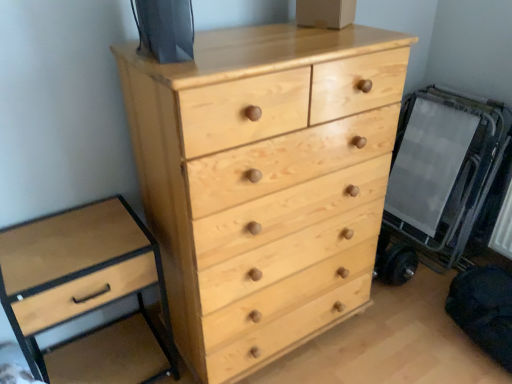
Question: In terms of width, does light wood/texture drawer at left, the 2th chest of drawers from the right, look wider or thinner when compared to natural wood chest of drawers at center, the second chest of drawers from the left?

Choices:
 (A) thin
 (B) wide

Answer: (A)

Question: Is light wood/texture drawer at left, which is the 1th chest of drawers from left to right, in front of or behind natural wood chest of drawers at center, the second chest of drawers from the left, in the image?

Choices:
 (A) front
 (B) behind

Answer: (B)

Question: From the image's perspective, relative to natural wood chest of drawers at center, which appears as the first chest of drawers when viewed from the right, is light wood/texture drawer at left, which is the 1th chest of drawers from left to right, above or below?

Choices:
 (A) below
 (B) above

Answer: (A)

Question: From a real-world perspective, is natural wood chest of drawers at center, which appears as the first chest of drawers when viewed from the right, above or below light wood/texture drawer at left, which is the 1th chest of drawers from left to right?

Choices:
 (A) above
 (B) below

Answer: (A)

Question: Which is correct: natural wood chest of drawers at center, the second chest of drawers from the left, is inside light wood/texture drawer at left, the 2th chest of drawers from the right, or outside of it?

Choices:
 (A) inside
 (B) outside

Answer: (B)

Question: In the image, is natural wood chest of drawers at center, the second chest of drawers from the left, positioned in front of or behind light wood/texture drawer at left, the 2th chest of drawers from the right?

Choices:
 (A) behind
 (B) front

Answer: (B)

Question: In terms of width, does natural wood chest of drawers at center, the second chest of drawers from the left, look wider or thinner when compared to light wood/texture drawer at left, the 2th chest of drawers from the right?

Choices:
 (A) wide
 (B) thin

Answer: (A)